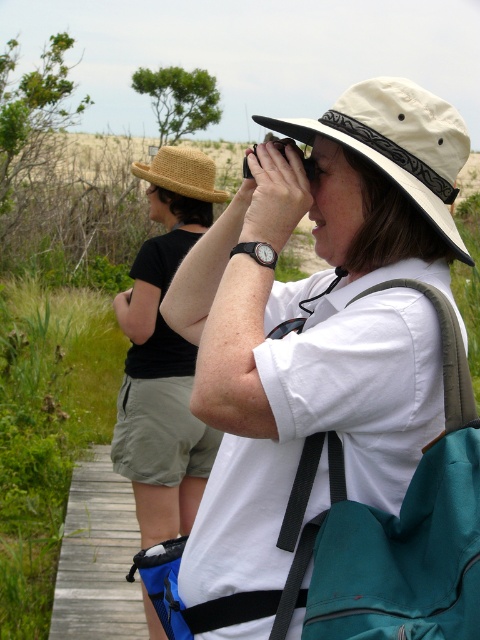
Question: Which object is positioned farthest from the beige fabric hat at center?

Choices:
 (A) teal fabric backpack at center
 (B) straw hat at left
 (C) wooden boardwalk at lower left
 (D) white cotton shirt at center

Answer: (C)

Question: Is white cotton shirt at center bigger than beige fabric hat at center?

Choices:
 (A) no
 (B) yes

Answer: (B)

Question: Estimate the real-world distances between objects in this image. Which object is closer to the straw hat at upper left?

Choices:
 (A) white cotton shirt at center
 (B) straw hat at left
 (C) teal fabric backpack at center

Answer: (B)

Question: Which object is farther from the camera taking this photo?

Choices:
 (A) straw hat at left
 (B) white cotton shirt at center
 (C) beige fabric hat at center

Answer: (A)

Question: Can you confirm if white cotton shirt at center is thinner than straw hat at left?

Choices:
 (A) yes
 (B) no

Answer: (B)

Question: Does straw hat at left appear on the right side of wooden boardwalk at lower left?

Choices:
 (A) yes
 (B) no

Answer: (A)